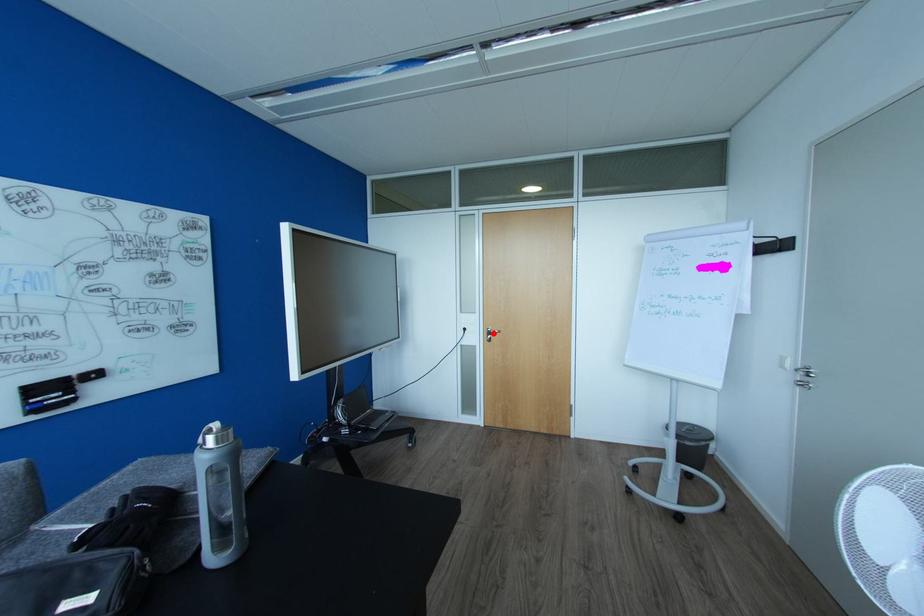
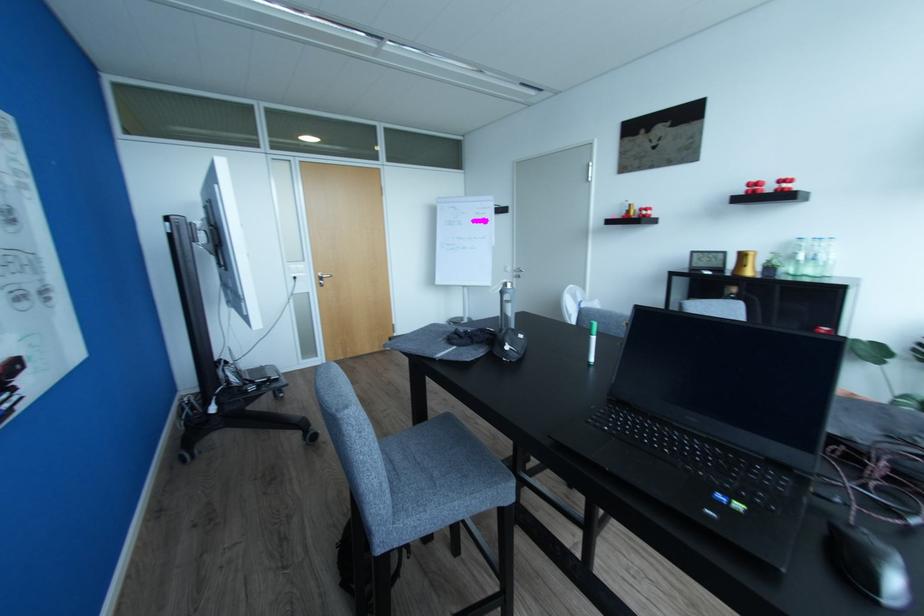
Question: I am providing you with two images of the same scene from different viewpoints. A red point is marked on the first image. At the location where the point appears in image 1, is it still visible in image 2?

Choices:
 (A) Yes
 (B) No

Answer: (A)